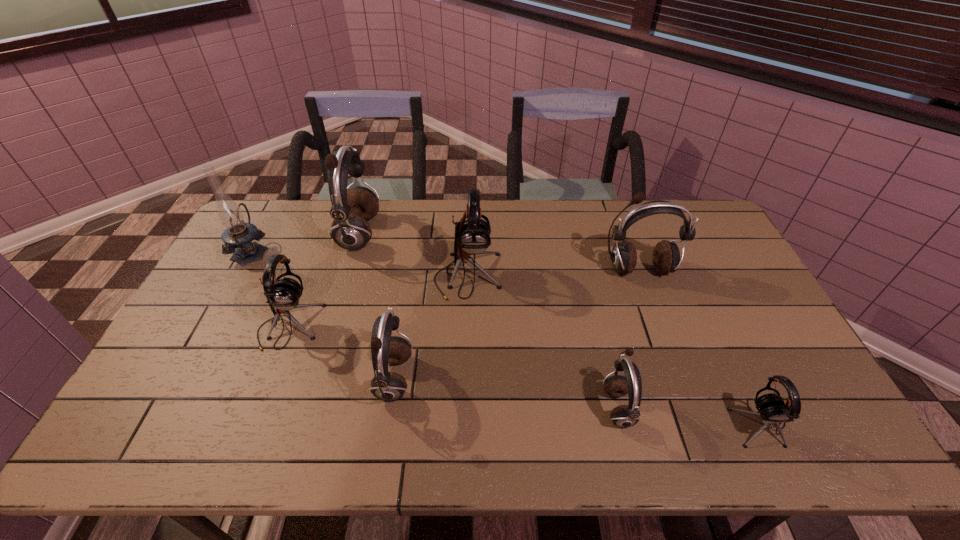
Locate an element on the screen. The width and height of the screenshot is (960, 540). vacant space located on the ear pads of the third brown earphone from left to right is located at coordinates coord(451,406).

Locate an element on the screen. This screenshot has width=960, height=540. vacant space situated on the ear pads of the third brown earphone from left to right is located at coordinates (459, 406).

I want to click on vacant space positioned 0.300m on the ear pads of the third brown earphone from left to right, so click(483, 406).

Locate an element on the screen. This screenshot has width=960, height=540. free space located on the left of the nearest black earphone is located at coordinates (629, 422).

You are a GUI agent. You are given a task and a screenshot of the screen. Output one action in this format:
    pyautogui.click(x=<x>, y=<y>)
    Task: Click on the earphone that is at the far edge
    This screenshot has height=540, width=960.
    Given the screenshot: What is the action you would take?
    pyautogui.click(x=351, y=209)

Image resolution: width=960 pixels, height=540 pixels. Identify the location of oil lamp located in the far edge section of the desktop. (238, 235).

Where is `object at the left edge`? Image resolution: width=960 pixels, height=540 pixels. object at the left edge is located at coordinates (238, 235).

This screenshot has width=960, height=540. Find the location of `object at the right edge`. object at the right edge is located at coordinates (771, 407).

Where is `object that is at the far left corner`? The height and width of the screenshot is (540, 960). object that is at the far left corner is located at coordinates (238, 235).

Identify the location of object located at the near right corner. (771, 407).